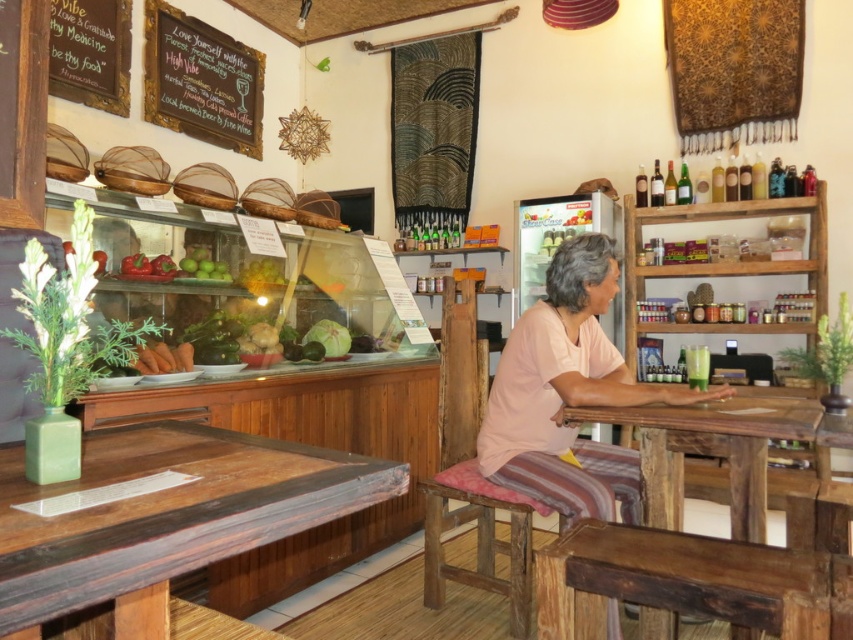
You are standing at the entrance of the cafe and want to sit down. Which object, the dark brown wood table at center or the rustic wood stool at center, would you reach first as you walk towards them?

You would reach the dark brown wood table at center first because it is closer to you than the rustic wood stool at center.

What is the location of the point marked at coordinates (715, 449) in the image?

The point marked at coordinates (715, 449) is located on the dark brown wood table at center.